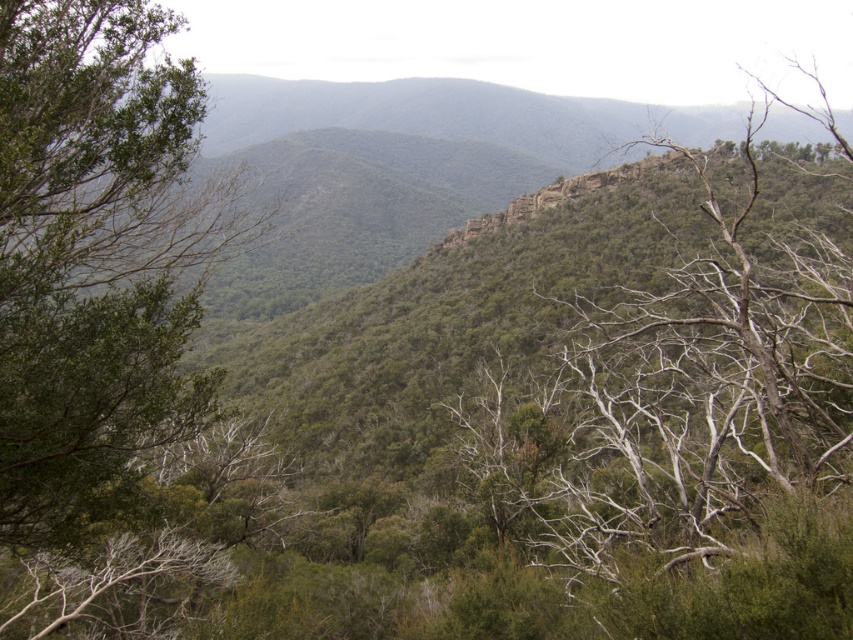
You are standing at the center of the image. Which direction should you walk to reach the green leafy tree at left?

You should walk to the left to reach the green leafy tree at left since it is located at the left side of the image.

You are a hiker trying to determine which tree to climb for a better view. Given that the green leafy tree at left and the green leafy tree at upper right are both in sight, which one would provide a higher vantage point?

The green leafy tree at upper right is larger in size compared to the green leafy tree at left, so climbing it would provide a higher vantage point.